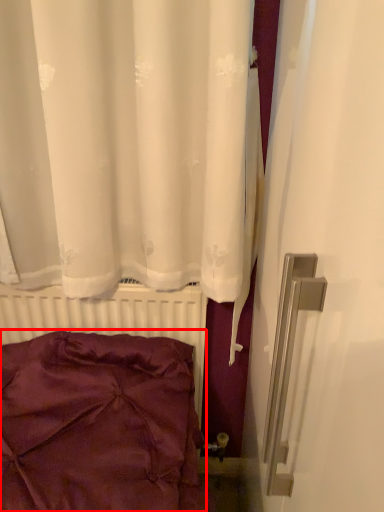
Question: From the image's perspective, what is the correct spatial positioning of pillow (annotated by the red box) in reference to radiator?

Choices:
 (A) below
 (B) above

Answer: (B)